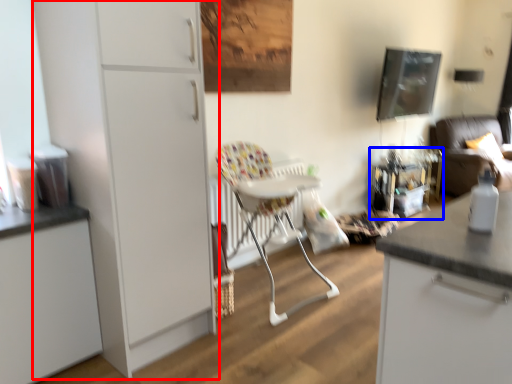
Question: Which object is further to the camera taking this photo, cabinetry (highlighted by a red box) or table (highlighted by a blue box)?

Choices:
 (A) cabinetry
 (B) table

Answer: (B)